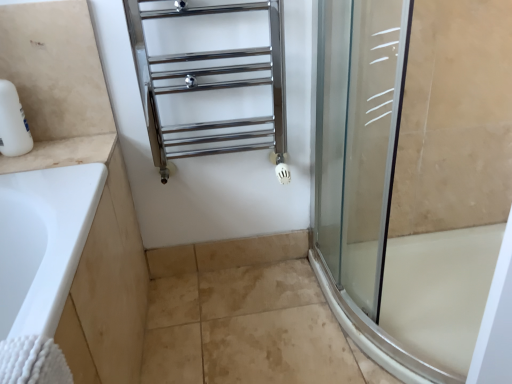
You are a GUI agent. You are given a task and a screenshot of the screen. Output one action in this format:
    pyautogui.click(x=<x>, y=<y>)
    Task: Click on the blank area beneath polished chrome towel rack at upper center (from a real-world perspective)
    
    Given the screenshot: What is the action you would take?
    pyautogui.click(x=228, y=279)